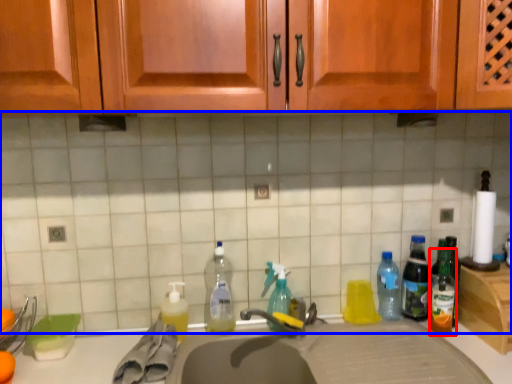
Question: Which of the following is the closest to the observer, bottle (highlighted by a red box) or tile (highlighted by a blue box)?

Choices:
 (A) bottle
 (B) tile

Answer: (B)